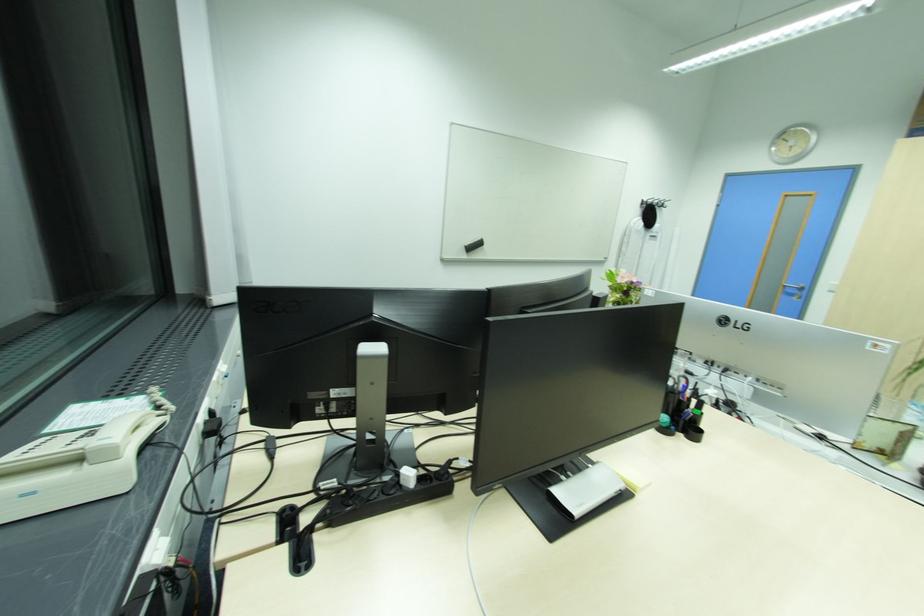
The width and height of the screenshot is (924, 616). I want to click on silver external hub, so click(x=793, y=143).